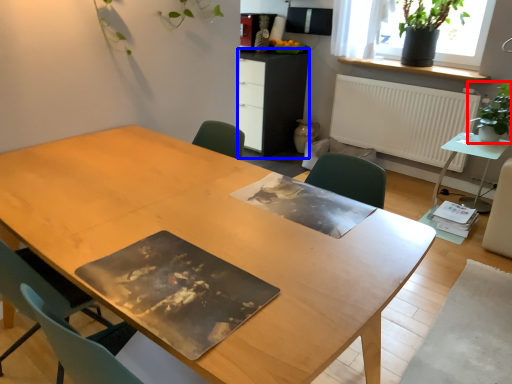
Question: Among these objects, which one is nearest to the camera, houseplant (highlighted by a red box) or computer desk (highlighted by a blue box)?

Choices:
 (A) houseplant
 (B) computer desk

Answer: (A)